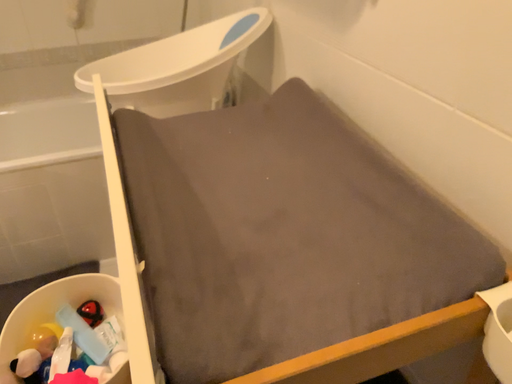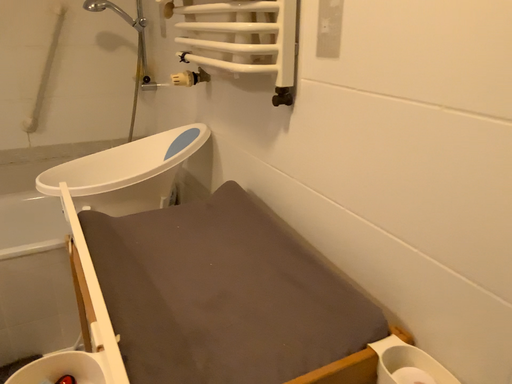
Question: How did the camera likely rotate when shooting the video?

Choices:
 (A) rotated downward
 (B) rotated upward

Answer: (B)